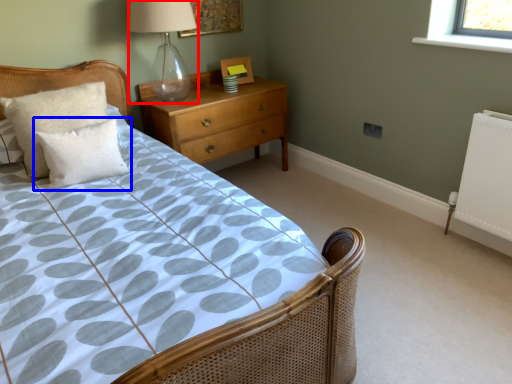
Question: Which object is further to the camera taking this photo, table lamp (highlighted by a red box) or pillow (highlighted by a blue box)?

Choices:
 (A) table lamp
 (B) pillow

Answer: (A)